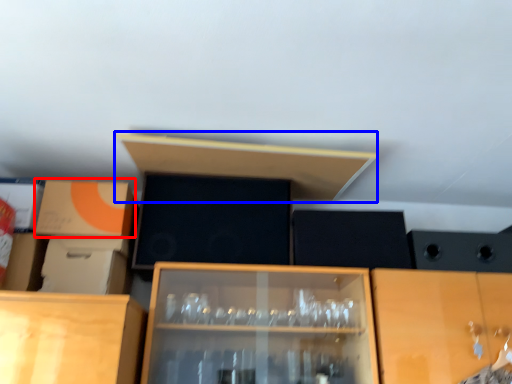
Question: Which point is closer to the camera, cardboard box (highlighted by a red box) or shelf (highlighted by a blue box)?

Choices:
 (A) cardboard box
 (B) shelf

Answer: (B)